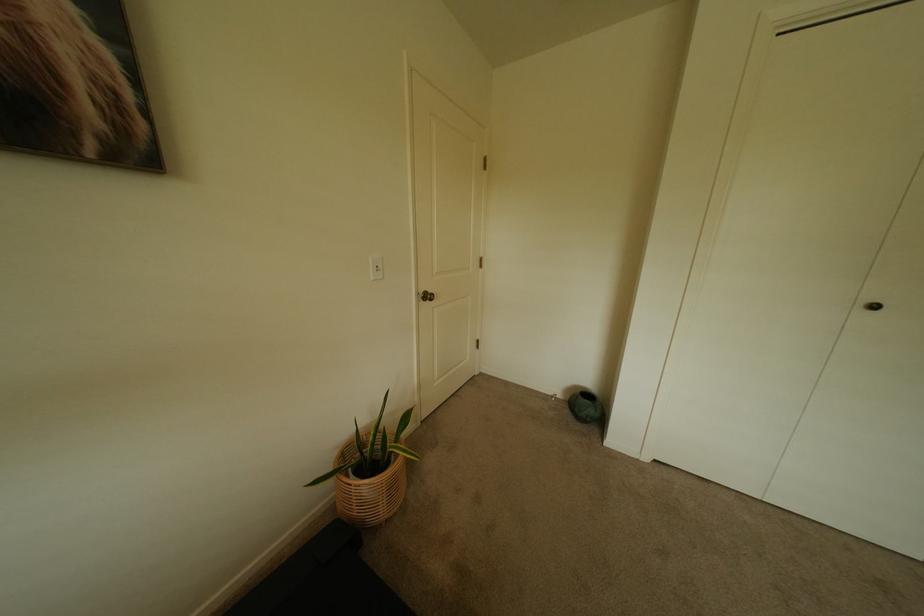
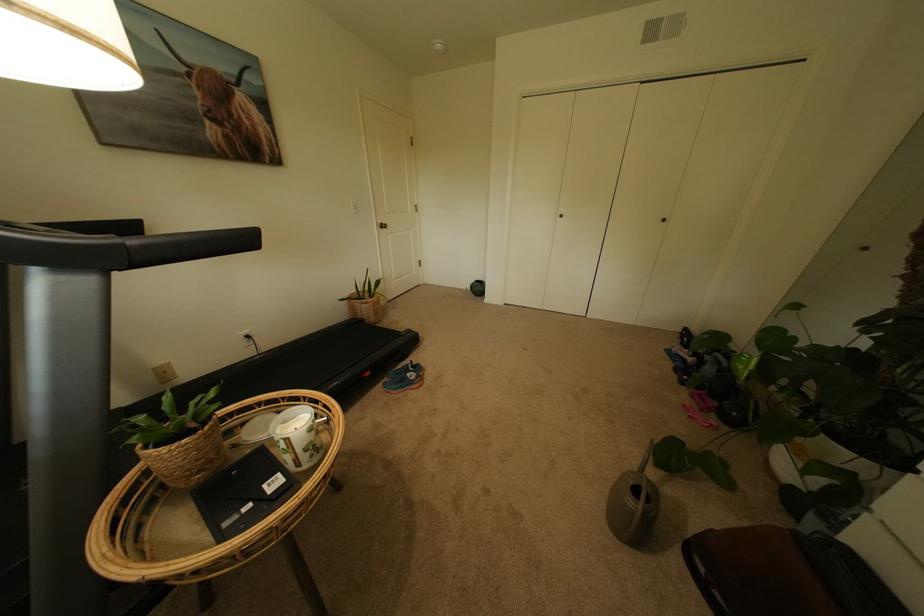
Locate, in the second image, the point that corresponds to point 440,301 in the first image.

(394, 229)